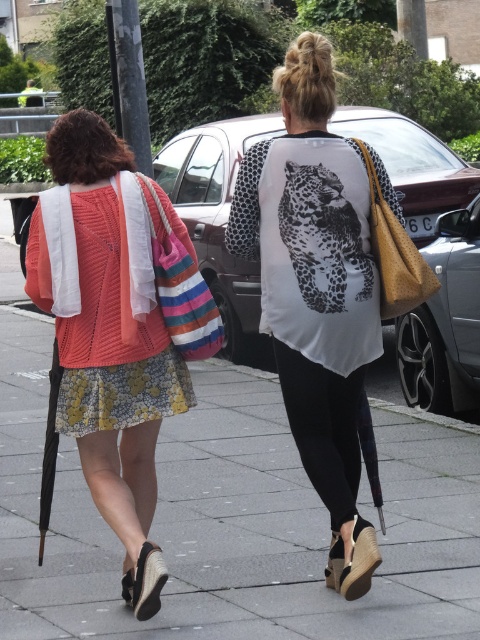
You are a pedestrian standing at the center of the sidewalk. You see a shiny black car at right and a printed cotton dress at center. How far apart are these two objects?

The shiny black car at right and the printed cotton dress at center are 3.40 meters apart from each other.

You are a photographer trying to capture a candid shot of both the knitted cotton sweater at left and the printed cotton dress at center. Your camera has a maximum focus range of 7 inches. Can you fit both subjects into the frame without moving closer?

The knitted cotton sweater at left is 7.21 inches away from the printed cotton dress at center, which exceeds the camera maximum focus range of 7 inches. Therefore, you cannot fit both subjects into the frame without moving closer.